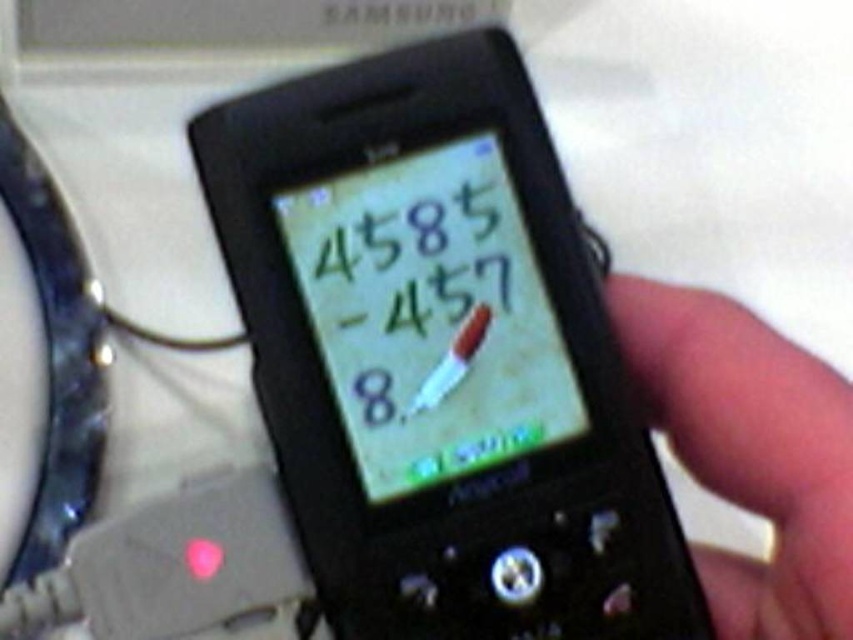
You are trying to place both the black plastic phone at center and the black matte phone at right into a phone case that can only accommodate a width of 10 cm. Given their widths, can both fit into the case simultaneously?

The black plastic phone at center is wider than the black matte phone at right. Since the case can only hold up to 10 cm, both cannot fit together unless the combined width is under 10 cm. However, without knowing each phone width individually, we can only state their relative sizes.

You are trying to place both the black plastic phone at center and the black matte phone at right into a drawer. The drawer has a height of 10 cm. Can you fit both phones vertically without overlapping?

The black plastic phone at center is located above black matte phone at right, but their individual heights are not specified. Therefore, it is impossible to determine if they can fit vertically in the 10 cm tall drawer without knowing their exact dimensions.